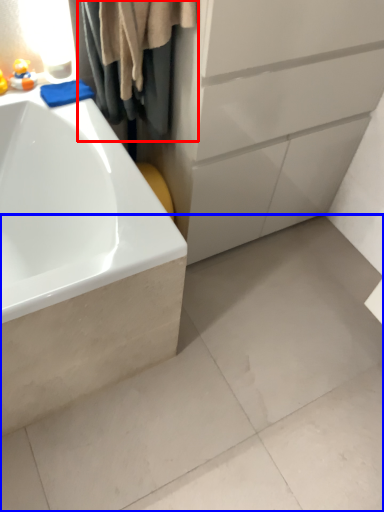
Question: Among these objects, which one is farthest to the camera, shower curtain (highlighted by a red box) or concrete (highlighted by a blue box)?

Choices:
 (A) shower curtain
 (B) concrete

Answer: (B)